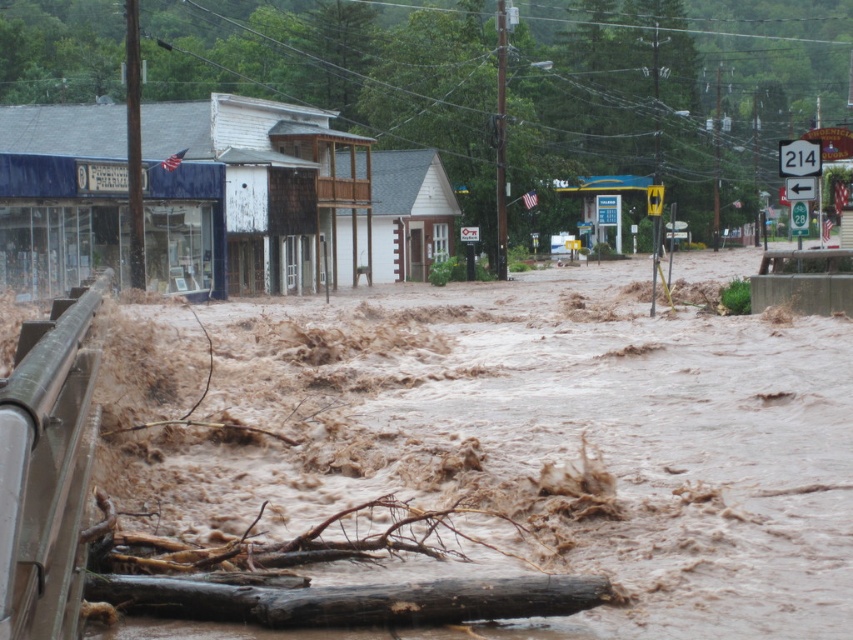
Between white wooden building at center and brown rough wood log at lower center, which one has more height?

white wooden building at center

Locate an element on the screen. Image resolution: width=853 pixels, height=640 pixels. white wooden building at center is located at coordinates (283, 200).

Does point (415, 339) come behind point (306, 259)?

That is False.

Does brown muddy water at lower left have a smaller size compared to white wooden building at center?

Yes.

Where is `brown muddy water at lower left`? This screenshot has height=640, width=853. brown muddy water at lower left is located at coordinates (546, 444).

Does brown muddy water at lower left have a lesser width compared to brown rough wood log at lower center?

Incorrect, brown muddy water at lower left's width is not less than brown rough wood log at lower center's.

Is brown muddy water at lower left behind brown rough wood log at lower center?

That is True.

Does point (550, 384) come closer to viewer compared to point (140, 604)?

No, (550, 384) is further to viewer.

Locate an element on the screen. The width and height of the screenshot is (853, 640). brown muddy water at lower left is located at coordinates (546, 444).